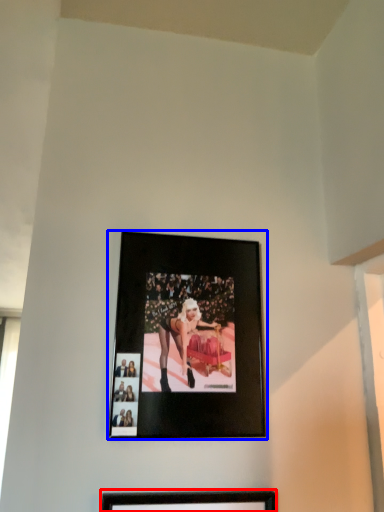
Question: Which point is further to the camera, picture frame (highlighted by a red box) or picture frame (highlighted by a blue box)?

Choices:
 (A) picture frame
 (B) picture frame

Answer: (B)